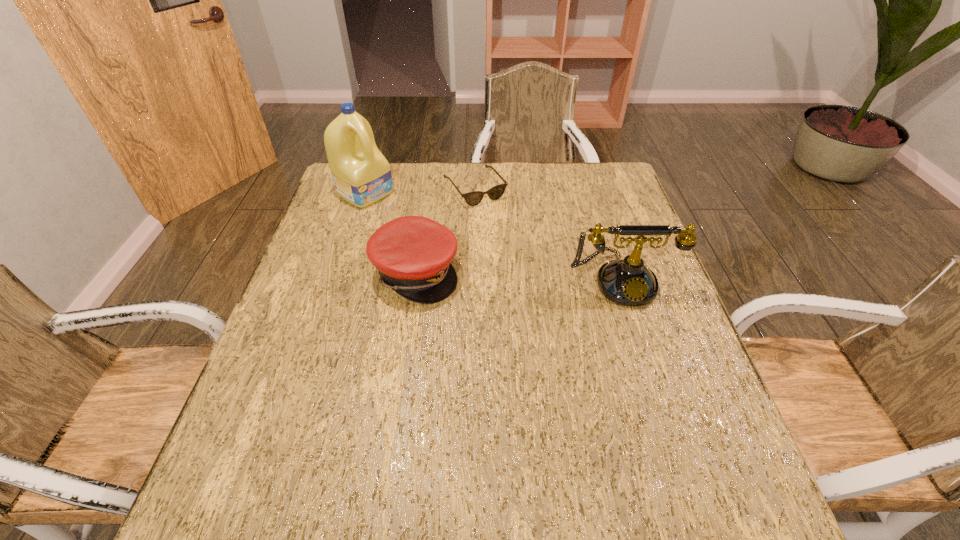
Locate an element on the screen. free spot on the desktop that is between the second shortest object and the rightmost object and is positioned on the front lenses of the shortest object is located at coordinates (545, 276).

Locate an element on the screen. free space on the desktop that is between the second shortest object and the rightmost object and is positioned on the label of the detergent is located at coordinates (501, 275).